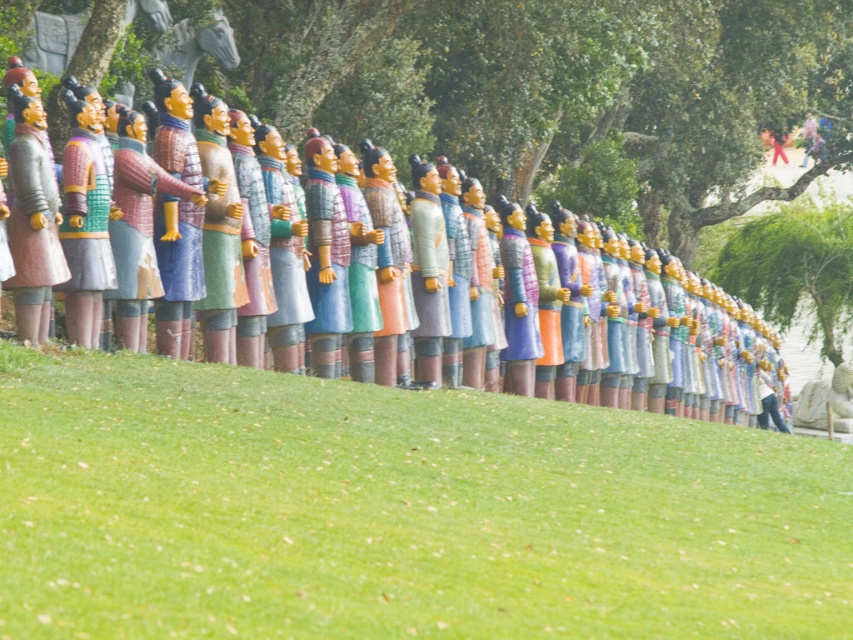
Question: Is green leafy tree at upper center in front of matte painted statue at center?

Choices:
 (A) no
 (B) yes

Answer: (A)

Question: Among these objects, which one is nearest to the camera?

Choices:
 (A) green leafy tree at upper center
 (B) matte painted statue at center

Answer: (B)

Question: Can you confirm if green leafy tree at upper center is positioned below matte painted statue at center?

Choices:
 (A) no
 (B) yes

Answer: (A)

Question: Which point is farther to the camera?

Choices:
 (A) (233, 566)
 (B) (697, 396)
 (C) (440, 120)

Answer: (C)

Question: Can you confirm if green grass at lower center is wider than matte painted statue at center?

Choices:
 (A) yes
 (B) no

Answer: (B)

Question: Which point appears closest to the camera in this image?

Choices:
 (A) (234, 1)
 (B) (714, 305)

Answer: (A)